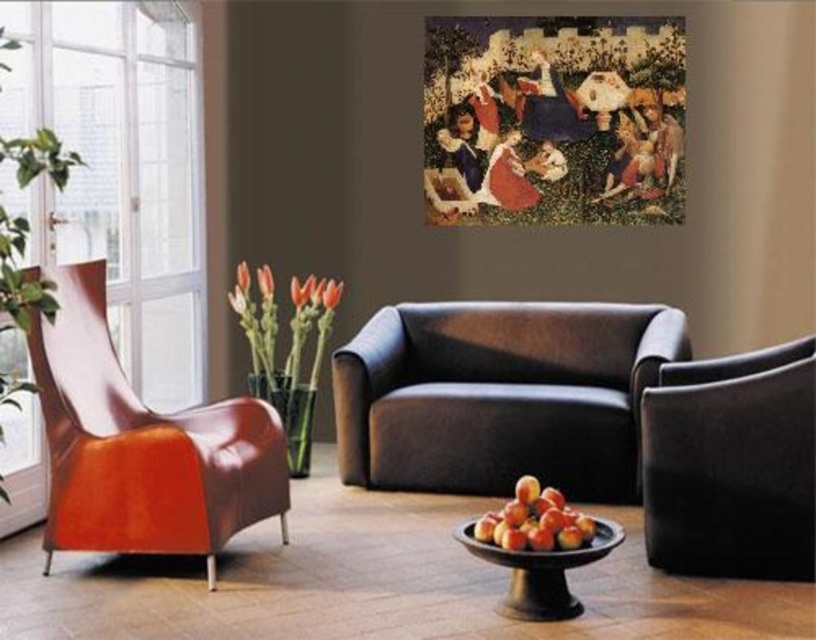
Question: Is glossy leather armchair at left to the right of black fabric armchair at right from the viewer's perspective?

Choices:
 (A) no
 (B) yes

Answer: (A)

Question: Which of the following is the closest to the observer?

Choices:
 (A) (805, 579)
 (B) (626, 422)
 (C) (510, 582)
 (D) (566, 538)

Answer: (D)

Question: Does dark brown leather couch at center appear on the right side of black glossy bowl at lower center?

Choices:
 (A) yes
 (B) no

Answer: (A)

Question: Can you confirm if dark brown leather couch at center is positioned to the right of glossy wooden bowl of peaches at lower center?

Choices:
 (A) yes
 (B) no

Answer: (A)

Question: Which point appears farthest from the camera in this image?

Choices:
 (A) (486, 540)
 (B) (562, 609)

Answer: (A)

Question: Which point is closer to the camera?

Choices:
 (A) glossy wooden bowl of peaches at lower center
 (B) black fabric armchair at right

Answer: (A)